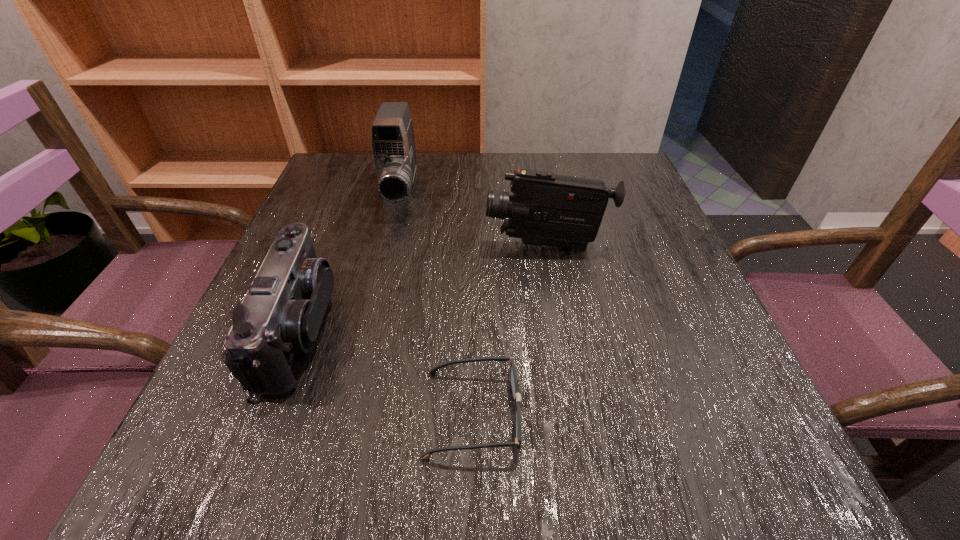
The image size is (960, 540). Find the location of `free space located 0.110m on the front-facing side of the second farthest camcorder`. free space located 0.110m on the front-facing side of the second farthest camcorder is located at coordinates click(431, 245).

At what (x,y) coordinates should I click in order to perform the action: click on free space located on the front-facing side of the nearest camcorder. Please return your answer as a coordinate pair (x, y). Looking at the image, I should click on (560, 329).

Image resolution: width=960 pixels, height=540 pixels. Identify the location of vacant region located on the face of the shortest object. (763, 413).

Where is `object present at the far edge`? object present at the far edge is located at coordinates (393, 145).

What are the coordinates of `object at the near edge` in the screenshot? It's located at (513, 376).

Image resolution: width=960 pixels, height=540 pixels. In order to click on object that is at the right edge in this screenshot , I will do `click(549, 209)`.

The height and width of the screenshot is (540, 960). I want to click on object that is positioned at the far left corner, so click(x=393, y=145).

Where is `vacant position at the far edge of the desktop`? The width and height of the screenshot is (960, 540). vacant position at the far edge of the desktop is located at coordinates 562,174.

You are a GUI agent. You are given a task and a screenshot of the screen. Output one action in this format:
    pyautogui.click(x=<x>, y=<y>)
    Task: Click on the vacant space at the left edge of the desktop
    
    Given the screenshot: What is the action you would take?
    pyautogui.click(x=358, y=247)

This screenshot has width=960, height=540. In the image, there is a desktop. In order to click on vacant space at the right edge in this screenshot , I will do `click(726, 402)`.